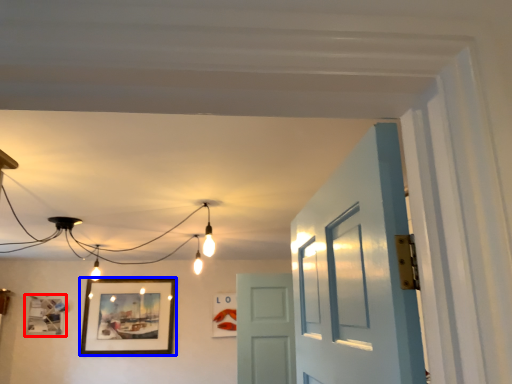
Question: Which object is further to the camera taking this photo, picture frame (highlighted by a red box) or picture frame (highlighted by a blue box)?

Choices:
 (A) picture frame
 (B) picture frame

Answer: (B)